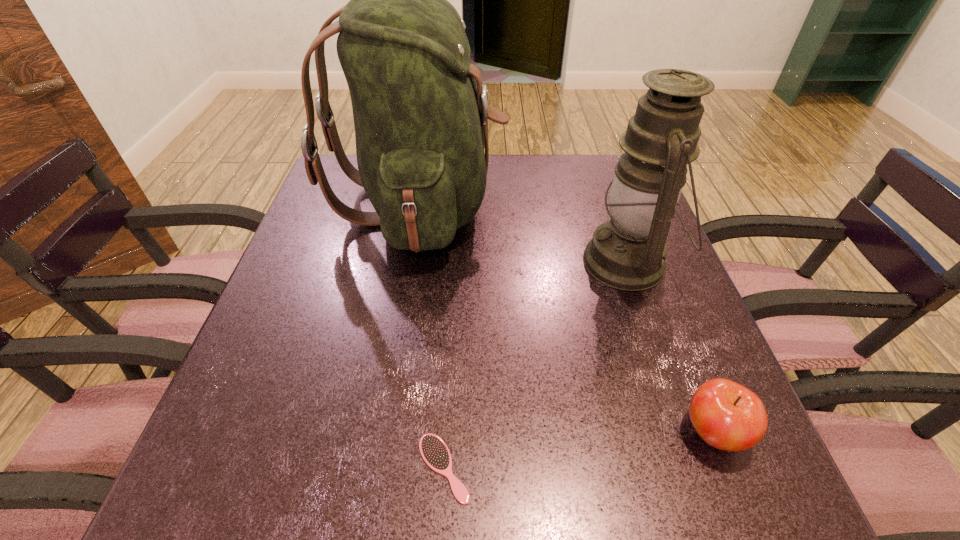
Choose which object is the second nearest neighbor to the shortest object. Please provide its 2D coordinates. Your answer should be formatted as a tuple, i.e. [(x, y)], where the tuple contains the x and y coordinates of a point satisfying the conditions above.

[(420, 110)]

Identify the location of object that is the third closest to the second shortest object. The width and height of the screenshot is (960, 540). (420, 110).

Where is `vacant space that satisfies the following two spatial constraints: 1. on the open flap of the second tallest object; 2. on the right side of the backpack`? vacant space that satisfies the following two spatial constraints: 1. on the open flap of the second tallest object; 2. on the right side of the backpack is located at coordinates (410, 262).

I want to click on vacant area that satisfies the following two spatial constraints: 1. on the open flap of the second tallest object; 2. on the left side of the backpack, so tap(410, 262).

Find the location of a particular element. The image size is (960, 540). free point that satisfies the following two spatial constraints: 1. on the open flap of the backpack; 2. on the left side of the apple is located at coordinates (381, 431).

Find the location of a particular element. free location that satisfies the following two spatial constraints: 1. on the open flap of the shortest object; 2. on the left side of the backpack is located at coordinates (375, 468).

Identify the location of free space that satisfies the following two spatial constraints: 1. on the open flap of the backpack; 2. on the left side of the hairbrush. (375, 468).

Identify the location of free space that satisfies the following two spatial constraints: 1. on the open flap of the third shortest object; 2. on the right side of the backpack. The image size is (960, 540). (410, 262).

This screenshot has width=960, height=540. I want to click on free space that satisfies the following two spatial constraints: 1. on the back side of the oil lamp; 2. on the open flap of the backpack, so pos(609,205).

Identify the location of free space that satisfies the following two spatial constraints: 1. on the open flap of the backpack; 2. on the right side of the apple. Image resolution: width=960 pixels, height=540 pixels. (381, 431).